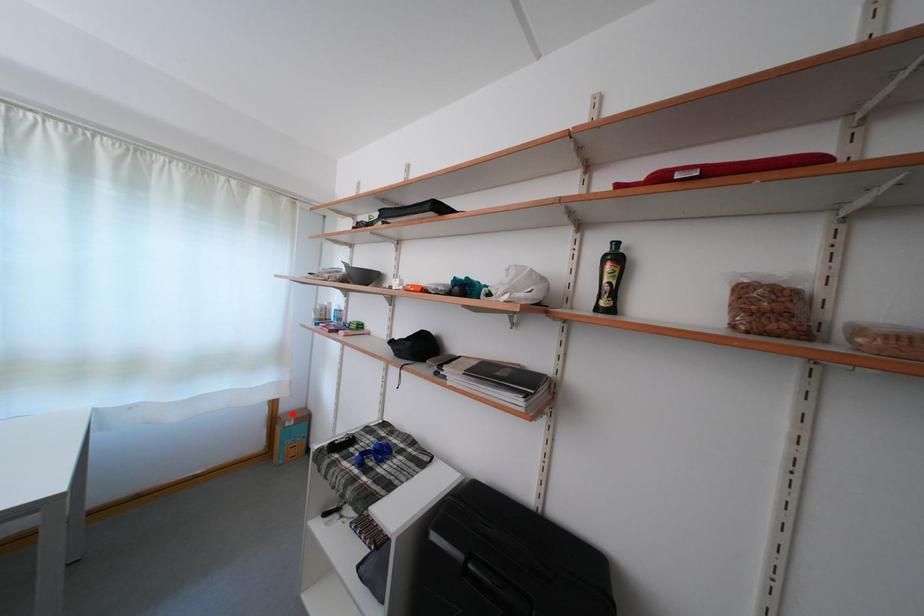
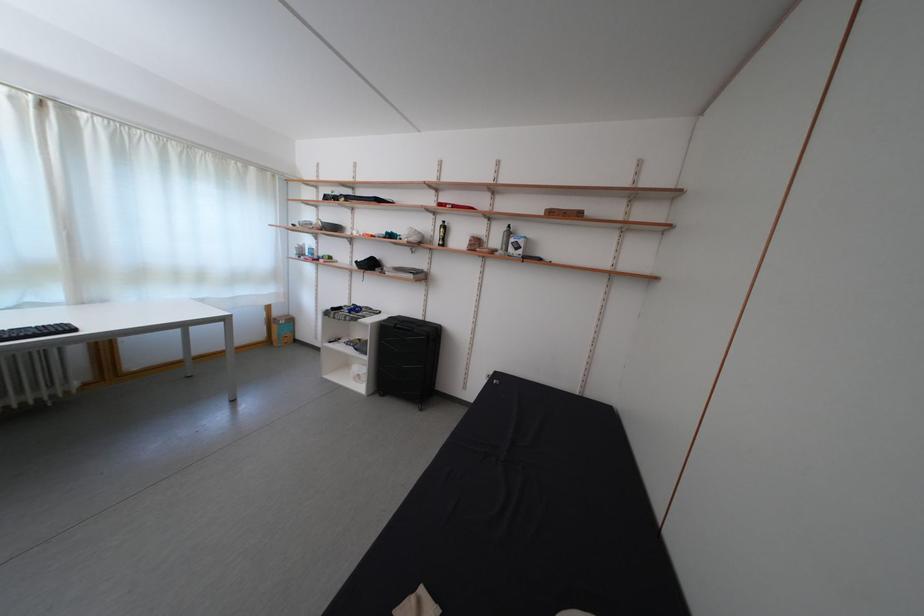
Find the pixel in the second image that matches the highlighted location in the first image.

(285, 320)